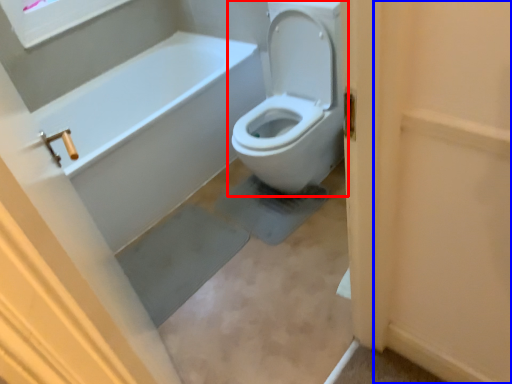
Question: Which object is closer to the camera taking this photo, toilet (highlighted by a red box) or screen door (highlighted by a blue box)?

Choices:
 (A) toilet
 (B) screen door

Answer: (B)